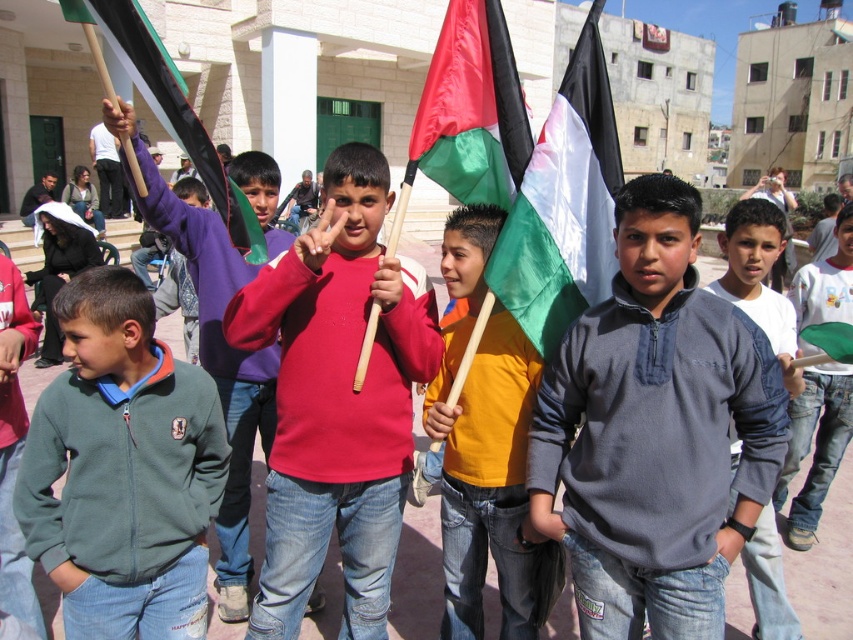
You are a photographer trying to capture a closeup of the matte red sweater at center. Based on the scene description, where should you focus your camera to ensure the sweater is in the frame?

The matte red sweater at center is located at the 2D coordinates point (x=337, y=400), so you should focus your camera there to ensure the sweater is in the frame.

You are organizing a clothing donation drive and need to categorize items based on their size. You have two items in front of you, the matte red sweater at center and the matte purple hoodie at center. Which one should you place in the small size bin?

The matte red sweater at center is smaller than the matte purple hoodie at center, so it should be placed in the small size bin.